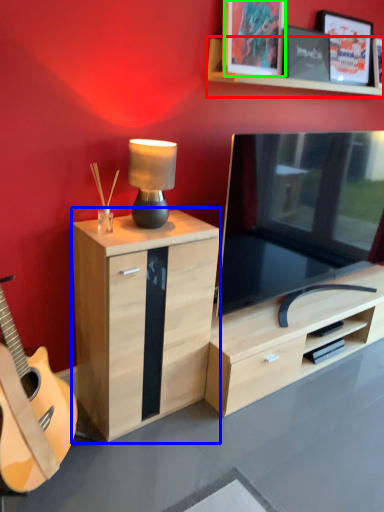
Question: Considering the real-world distances, which object is closest to shelf (highlighted by a red box)? chest of drawers (highlighted by a blue box) or picture frame (highlighted by a green box).

Choices:
 (A) chest of drawers
 (B) picture frame

Answer: (B)